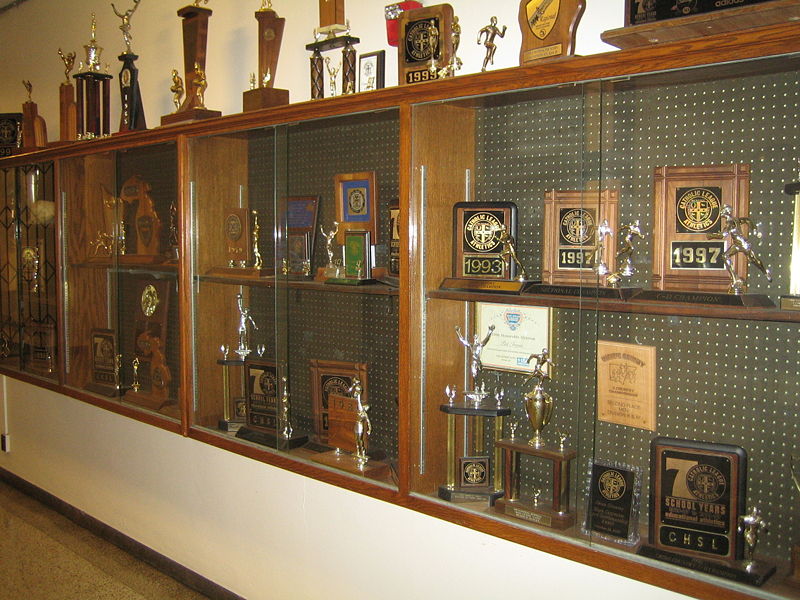
Identify the location of glass case. (328, 220).